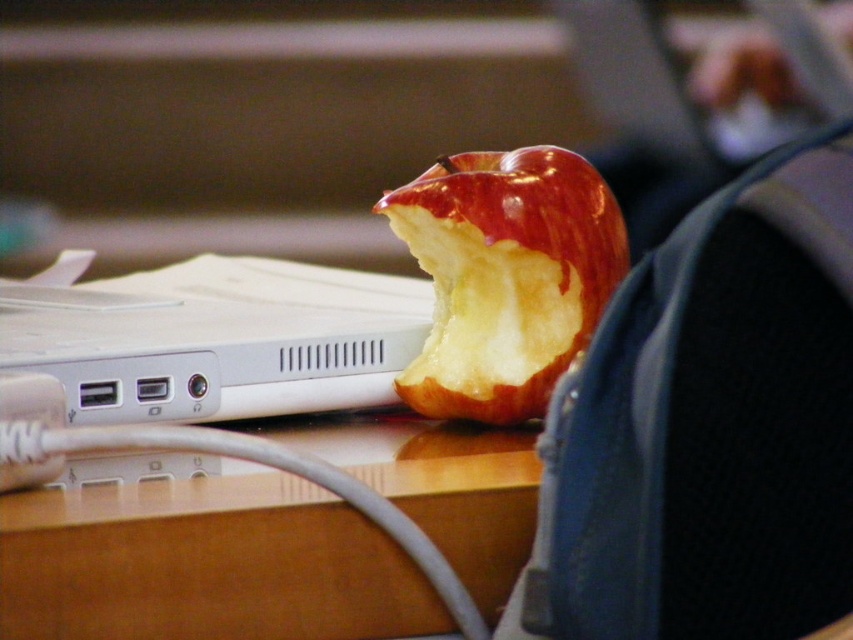
Who is more distant from viewer, (32,508) or (428,301)?

Point (428,301)

Based on the photo, who is higher up, brown wood table at center or white plastic laptop at center?

Positioned higher is white plastic laptop at center.

Between point (488, 570) and point (164, 394), which one is positioned in front?

Positioned in front is point (488, 570).

This screenshot has height=640, width=853. In order to click on brown wood table at center in this screenshot , I will do `click(268, 545)`.

Can you confirm if white plastic laptop at center is wider than shiny red apple at center?

Yes.

What do you see at coordinates (225, 340) in the screenshot?
I see `white plastic laptop at center` at bounding box center [225, 340].

Describe the element at coordinates (225, 340) in the screenshot. I see `white plastic laptop at center` at that location.

The image size is (853, 640). Identify the location of white plastic laptop at center. (225, 340).

Who is shorter, brown wood table at center or shiny red apple at center?

brown wood table at center is shorter.

In the scene shown: Does brown wood table at center have a greater height compared to shiny red apple at center?

No.

Locate an element on the screen. This screenshot has width=853, height=640. brown wood table at center is located at coordinates (268, 545).

Locate an element on the screen. Image resolution: width=853 pixels, height=640 pixels. brown wood table at center is located at coordinates (268, 545).